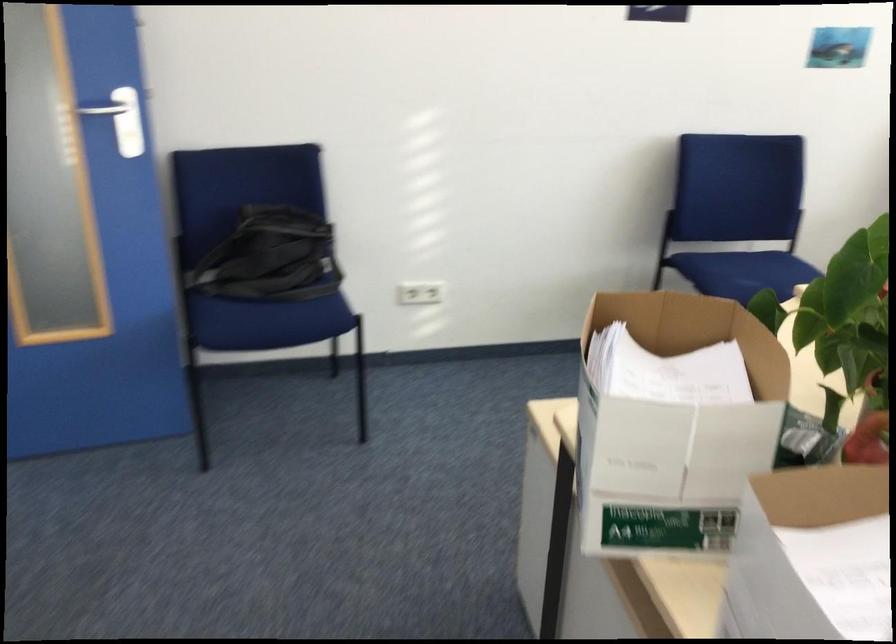
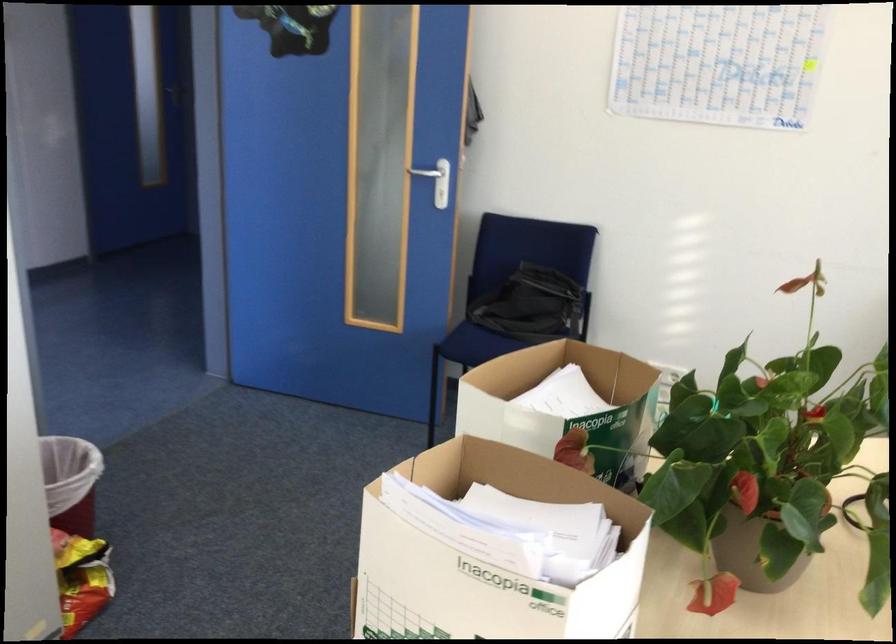
In the second image, find the point that corresponds to [271,225] in the first image.

(515, 275)